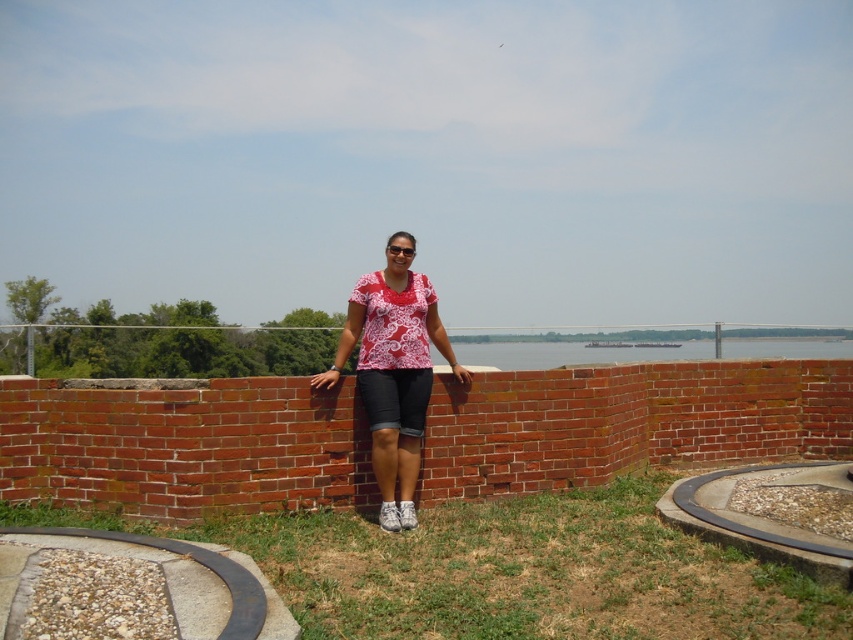
Question: Observing the image, what is the correct spatial positioning of matte red shirt at center in reference to clear water at center?

Choices:
 (A) above
 (B) below

Answer: (A)

Question: Which is nearer to the matte red shirt at center?

Choices:
 (A) clear water at center
 (B) green grass at lower center

Answer: (B)

Question: Does green grass at lower center appear on the left side of clear water at center?

Choices:
 (A) yes
 (B) no

Answer: (A)

Question: Which object is farther from the camera taking this photo?

Choices:
 (A) matte red shirt at center
 (B) clear water at center
 (C) green grass at lower center

Answer: (B)

Question: From the image, what is the correct spatial relationship of matte red shirt at center in relation to clear water at center?

Choices:
 (A) below
 (B) above

Answer: (B)

Question: Which is nearer to the matte red shirt at center?

Choices:
 (A) clear water at center
 (B) green grass at lower center

Answer: (B)